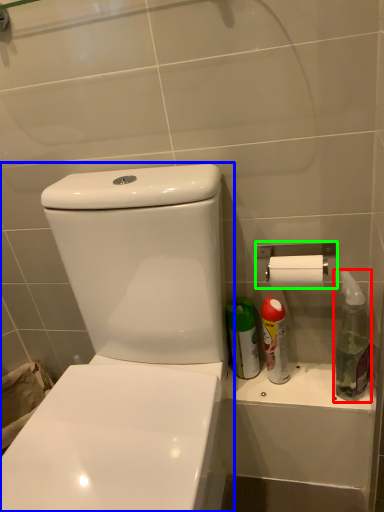
Question: Estimate the real-world distances between objects in this image. Which object is closer to cleaning product (highlighted by a red box), toilet (highlighted by a blue box) or towel bar (highlighted by a green box)?

Choices:
 (A) toilet
 (B) towel bar

Answer: (B)